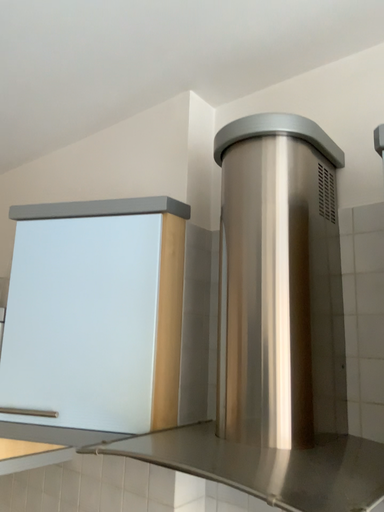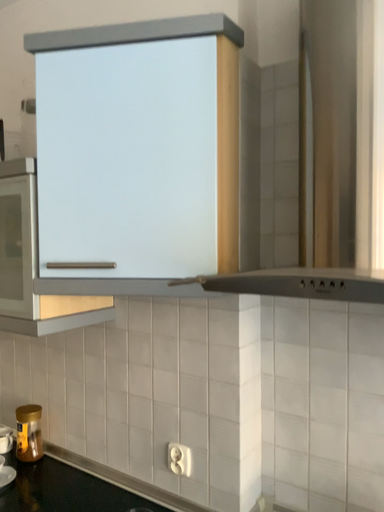
Question: Which way did the camera rotate in the video?

Choices:
 (A) rotated upward
 (B) rotated downward

Answer: (B)